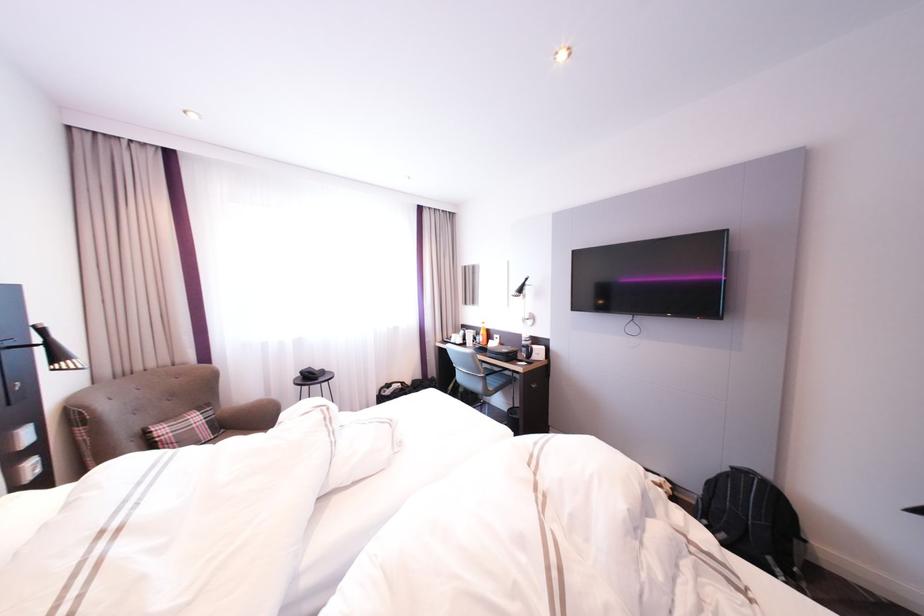
I want to click on black wall lamp, so click(x=25, y=397).